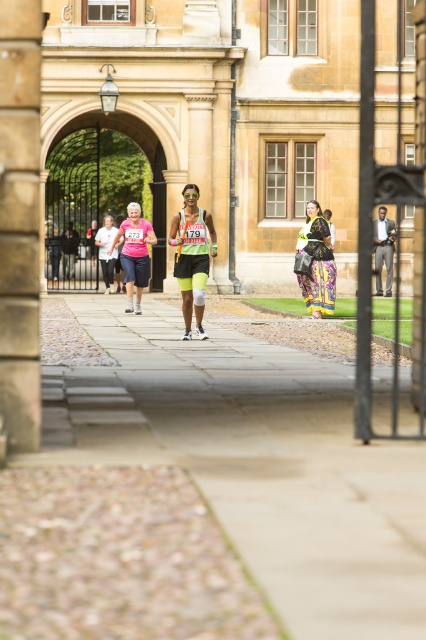
Which is above, floral fabric dress at center or pink fabric shorts at center?

pink fabric shorts at center is above.

Can you confirm if floral fabric dress at center is bigger than pink fabric shorts at center?

Yes.

At what (x,y) coordinates should I click in order to perform the action: click on floral fabric dress at center. Please return your answer as a coordinate pair (x, y). Looking at the image, I should click on (317, 262).

Is point (314, 292) behind point (380, 252)?

No, it is in front of (380, 252).

Which is in front, point (322, 221) or point (386, 236)?

Point (322, 221) is in front.

This screenshot has width=426, height=640. What do you see at coordinates (317, 262) in the screenshot? I see `floral fabric dress at center` at bounding box center [317, 262].

What are the coordinates of `floral fabric dress at center` in the screenshot? It's located at (317, 262).

Looking at this image, can you confirm if pebble stone pavement at center is bigger than matte black shorts at center?

Yes.

Between pebble stone pavement at center and matte black shorts at center, which one has more height?

matte black shorts at center

At what (x,y) coordinates should I click in order to perform the action: click on pebble stone pavement at center. Please return your answer as a coordinate pair (x, y). The height and width of the screenshot is (640, 426). Looking at the image, I should click on (259, 461).

Where is `pebble stone pavement at center`? pebble stone pavement at center is located at coordinates (259, 461).